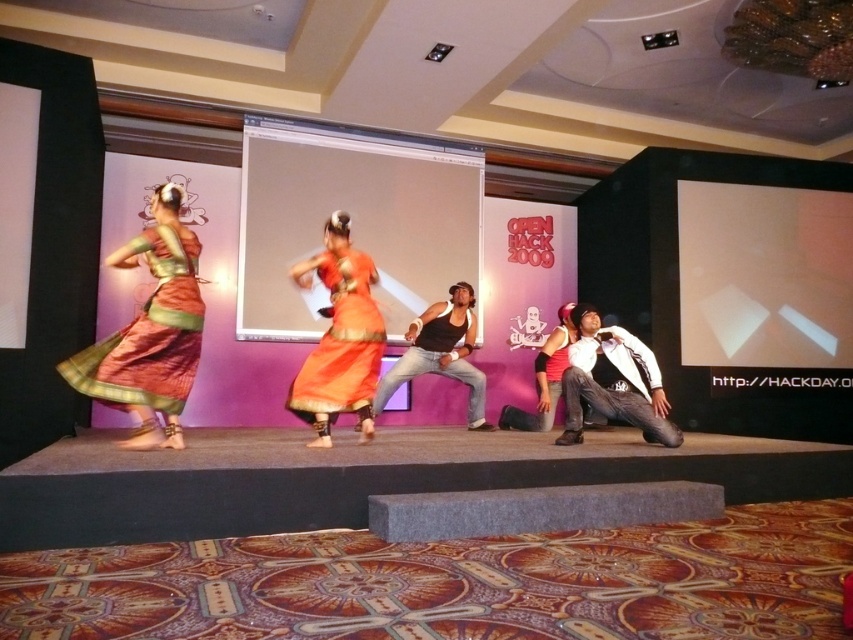
Question: Is silky orange saree at left behind white matte jacket at lower right?

Choices:
 (A) yes
 (B) no

Answer: (B)

Question: Is silky orange saree at left further to the viewer compared to white matte jacket at lower right?

Choices:
 (A) no
 (B) yes

Answer: (A)

Question: Is silky orange saree at left to the right of white matte jacket at lower right from the viewer's perspective?

Choices:
 (A) no
 (B) yes

Answer: (A)

Question: Which object is the closest to the orange silk dress at center?

Choices:
 (A) silky orange saree at left
 (B) white matte jacket at lower right

Answer: (A)

Question: Which of these objects is positioned closest to the white matte jacket at lower right?

Choices:
 (A) silky orange saree at left
 (B) orange silk dress at center

Answer: (B)

Question: Which of the following is the closest to the observer?

Choices:
 (A) orange silk dress at center
 (B) white matte jacket at lower right
 (C) silky orange saree at left

Answer: (C)